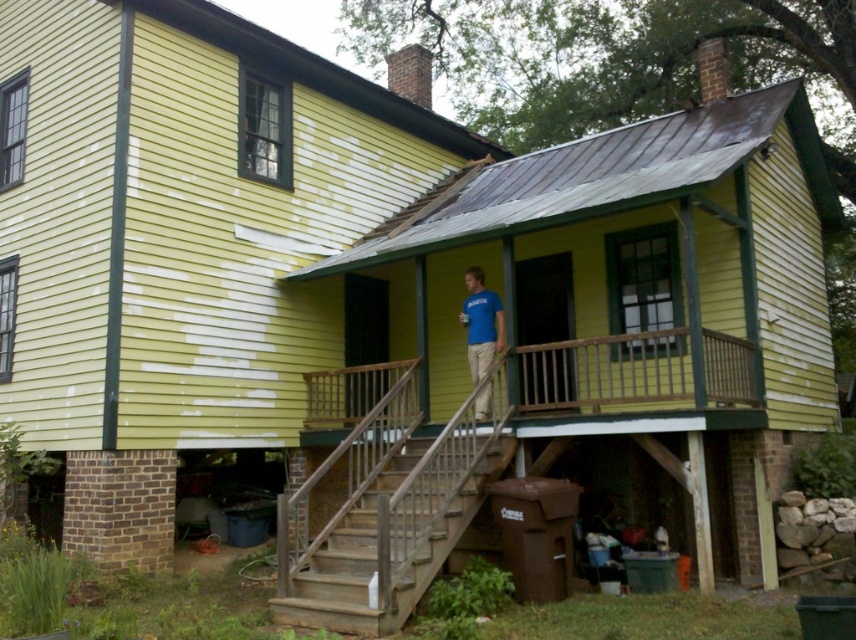
Question: Which object is the closest to the weathered wood stairs at center?

Choices:
 (A) blue t-shirt at center
 (B) wooden at center

Answer: (A)

Question: Considering the real-world distances, which object is closest to the blue t-shirt at center?

Choices:
 (A) wooden at center
 (B) weathered wood stairs at center

Answer: (A)

Question: Which point is closer to the camera taking this photo?

Choices:
 (A) (402, 620)
 (B) (485, 410)

Answer: (A)

Question: Observing the image, what is the correct spatial positioning of wooden at center in reference to weathered wood stairs at center?

Choices:
 (A) above
 (B) below

Answer: (A)

Question: Does wooden at center appear over blue t-shirt at center?

Choices:
 (A) no
 (B) yes

Answer: (A)

Question: Observing the image, what is the correct spatial positioning of weathered wood stairs at center in reference to blue t-shirt at center?

Choices:
 (A) left
 (B) right

Answer: (A)